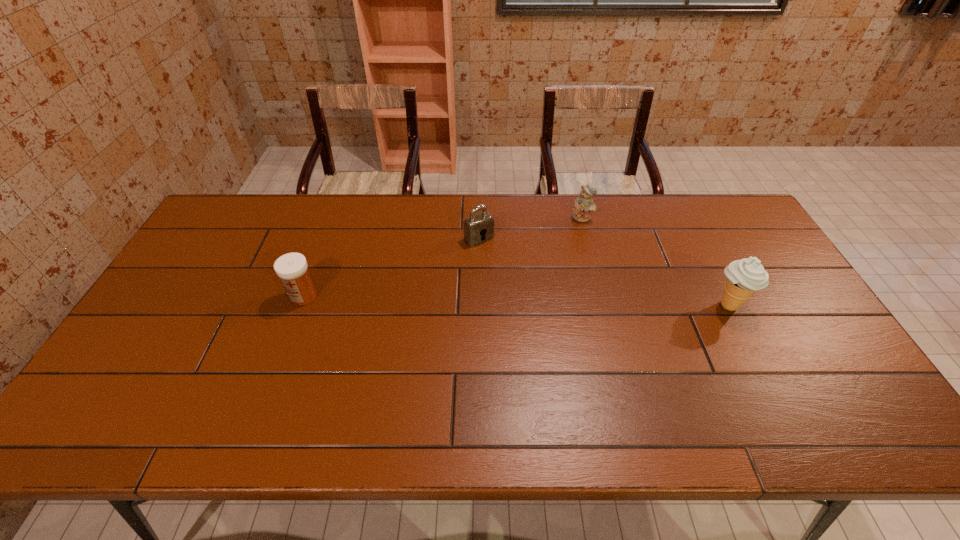
Where is `vacant space situated at the front of the padlock near the keyhole`? This screenshot has width=960, height=540. vacant space situated at the front of the padlock near the keyhole is located at coordinates (545, 313).

Where is `vacant space situated at the front of the padlock near the keyhole`? The height and width of the screenshot is (540, 960). vacant space situated at the front of the padlock near the keyhole is located at coordinates (543, 310).

At what (x,y) coordinates should I click in order to perform the action: click on vacant space situated 0.230m on the front-facing side of the farthest object. Please return your answer as a coordinate pair (x, y). This screenshot has height=540, width=960. Looking at the image, I should click on 566,268.

Where is `free space located 0.220m on the front-facing side of the farthest object`? The height and width of the screenshot is (540, 960). free space located 0.220m on the front-facing side of the farthest object is located at coordinates (566, 266).

Locate an element on the screen. free space located on the front-facing side of the farthest object is located at coordinates (554, 309).

What are the coordinates of `padlock at the far edge` in the screenshot? It's located at (479, 227).

Where is `teddy bear that is at the far edge`? The image size is (960, 540). teddy bear that is at the far edge is located at coordinates click(x=584, y=204).

The width and height of the screenshot is (960, 540). Identify the location of object present at the right edge. (744, 277).

You are a GUI agent. You are given a task and a screenshot of the screen. Output one action in this format:
    pyautogui.click(x=<x>, y=<y>)
    Task: Click on the free space at the far edge of the desktop
    The width and height of the screenshot is (960, 540).
    Given the screenshot: What is the action you would take?
    coord(315,225)

At what (x,y) coordinates should I click in order to perform the action: click on vacant space at the near edge of the desktop. Please return your answer as a coordinate pair (x, y). The height and width of the screenshot is (540, 960). Looking at the image, I should click on (414, 396).